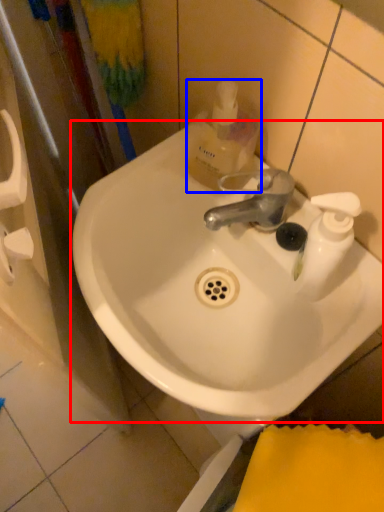
Question: Which object is closer to the camera taking this photo, sink (highlighted by a red box) or mouthwash (highlighted by a blue box)?

Choices:
 (A) sink
 (B) mouthwash

Answer: (A)